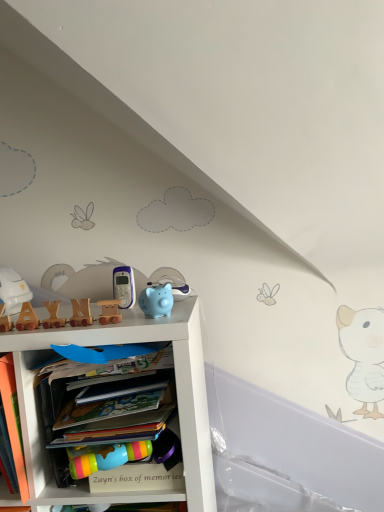
Question: Considering the relative positions of white matte helmet at left, positioned as the 1th toy in left-to-right order, and matte blue piggy bank at center, acting as the seventh toy starting from the left, in the image provided, is white matte helmet at left, positioned as the 1th toy in left-to-right order, to the left of matte blue piggy bank at center, acting as the seventh toy starting from the left, from the viewer's perspective?

Choices:
 (A) no
 (B) yes

Answer: (B)

Question: Is white matte helmet at left, marked as the 7th toy in a right-to-left arrangement, not within matte blue piggy bank at center, acting as the seventh toy starting from the left?

Choices:
 (A) no
 (B) yes

Answer: (B)

Question: From a real-world perspective, is white matte helmet at left, marked as the 7th toy in a right-to-left arrangement, positioned under matte blue piggy bank at center, acting as the seventh toy starting from the left, based on gravity?

Choices:
 (A) no
 (B) yes

Answer: (A)

Question: Is white matte helmet at left, marked as the 7th toy in a right-to-left arrangement, shorter than matte blue piggy bank at center, positioned as the first toy in right-to-left order?

Choices:
 (A) yes
 (B) no

Answer: (B)

Question: Is white matte helmet at left, marked as the 7th toy in a right-to-left arrangement, directly adjacent to matte blue piggy bank at center, acting as the seventh toy starting from the left?

Choices:
 (A) no
 (B) yes

Answer: (A)

Question: From a real-world perspective, is wooden train at center, arranged as the fifth toy when viewed from the right, positioned above or below wooden letter blocks at upper left, the sixth toy in the right-to-left sequence?

Choices:
 (A) above
 (B) below

Answer: (A)

Question: Relative to wooden letter blocks at upper left, the sixth toy in the right-to-left sequence, is wooden train at center, the third toy from the left, in front or behind?

Choices:
 (A) behind
 (B) front

Answer: (B)

Question: Does point (46, 302) appear closer or farther from the camera than point (21, 315)?

Choices:
 (A) farther
 (B) closer

Answer: (A)

Question: From the image's perspective, is wooden train at center, the third toy from the left, positioned above or below wooden letter blocks at upper left, the sixth toy in the right-to-left sequence?

Choices:
 (A) above
 (B) below

Answer: (A)

Question: Based on their positions, is wooden train at center, arranged as the fifth toy when viewed from the right, located to the left or right of white matte helmet at left, positioned as the 1th toy in left-to-right order?

Choices:
 (A) right
 (B) left

Answer: (A)

Question: From a real-world perspective, is wooden train at center, the third toy from the left, positioned above or below white matte helmet at left, marked as the 7th toy in a right-to-left arrangement?

Choices:
 (A) above
 (B) below

Answer: (B)

Question: Is wooden train at center, the third toy from the left, inside the boundaries of white matte helmet at left, positioned as the 1th toy in left-to-right order, or outside?

Choices:
 (A) inside
 (B) outside

Answer: (B)

Question: Is point (56, 318) closer or farther from the camera than point (3, 279)?

Choices:
 (A) closer
 (B) farther

Answer: (A)

Question: Based on their positions, is white matte shelf at center located to the left or right of white matte helmet at left, marked as the 7th toy in a right-to-left arrangement?

Choices:
 (A) left
 (B) right

Answer: (B)

Question: Considering their positions, is white matte shelf at center located in front of or behind white matte helmet at left, positioned as the 1th toy in left-to-right order?

Choices:
 (A) behind
 (B) front

Answer: (B)